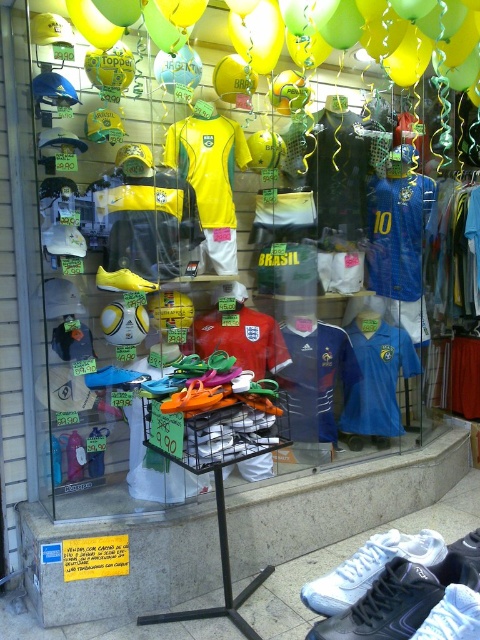
You are a customer looking at the storefront display. You notice the yellow glossy balloon at upper center and the white mesh shoe at lower right. Which object is positioned higher in the display?

The yellow glossy balloon at upper center is positioned higher in the display than the white mesh shoe at lower right.

From the picture: You are standing in front of the sports apparel store display and want to touch the two points marked in the scene. Which point, point (432, 540) or point (117, 278), is closer to your hand?

Point (432, 540) is closer to the viewer than point (117, 278), so it is closer to your hand.

Looking at this image, you are standing in front of the storefront display and want to locate the yellow glossy balloon at upper center. Based on the coordinates provided in the Objects Description, can you determine its position relative to the center of the display?

The yellow glossy balloon at upper center is located at point coordinates closer to the left edge and slightly above the center of the display, since its x coordinate is 0.056 which is near the left edge and y coordinate 0.760 is slightly above the center.